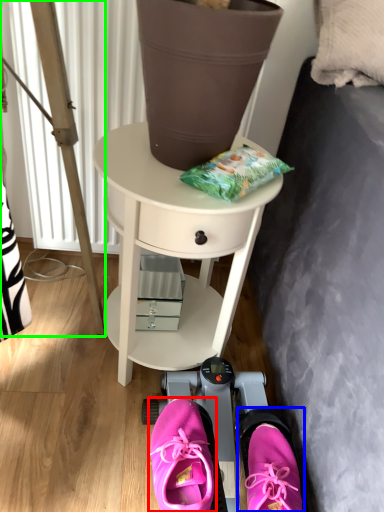
Question: Based on their relative distances, which object is nearer to footwear (highlighted by a red box)? Choose from footwear (highlighted by a blue box) and ladder (highlighted by a green box).

Choices:
 (A) footwear
 (B) ladder

Answer: (A)